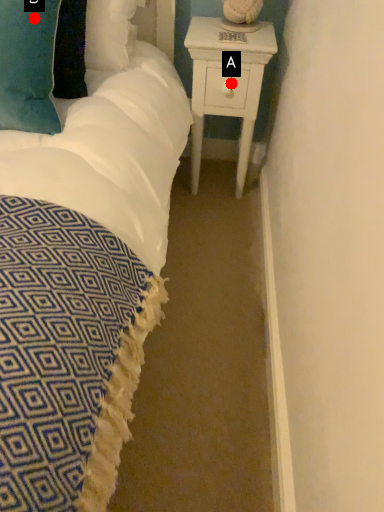
Question: Two points are circled on the image, labeled by A and B beside each circle. Which point appears closest to the camera in this image?

Choices:
 (A) A is closer
 (B) B is closer

Answer: (B)